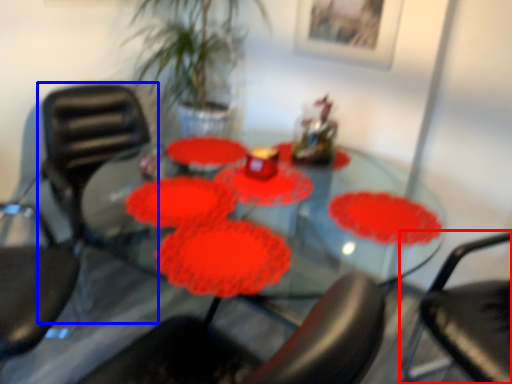
Question: Which object appears farthest to the camera in this image, chair (highlighted by a red box) or chair (highlighted by a blue box)?

Choices:
 (A) chair
 (B) chair

Answer: (B)